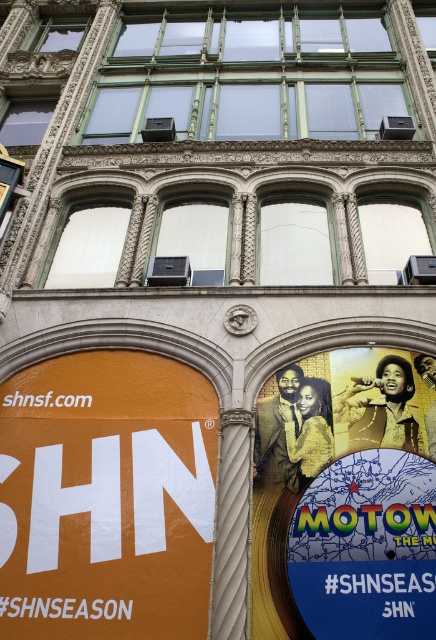
You are an advertiser planning to hang a new rectangular poster between the orange matte sign at lower left and the matte vinyl record at center. Based on their current arrangement, which side of the poster should you align it to ensure it stays centered between them?

Since the orange matte sign at lower left is positioned on the left side of the matte vinyl record at center, aligning the poster to the right side of the orange matte sign at lower left and the left side of the matte vinyl record at center will ensure it stays centered between them.

You are standing in front of the building and notice a point marked at coordinates (106, 499). Based on the scene description, what object is located at this point?

The point at coordinates (106, 499) marks the orange matte sign at lower left.